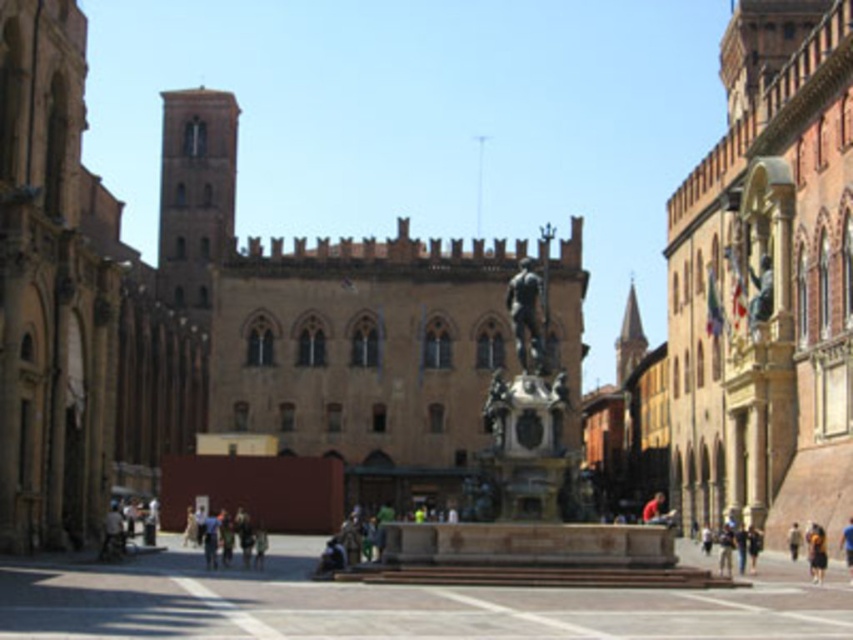
Can you confirm if brown stone bell tower at upper left is positioned above blue fabric person at center?

Yes, brown stone bell tower at upper left is above blue fabric person at center.

Which is behind, point (198, 138) or point (846, 561)?

The point (198, 138) is behind.

Who is more forward, (x=198, y=314) or (x=851, y=556)?

Positioned in front is point (x=851, y=556).

Where is `brown stone bell tower at upper left`? Image resolution: width=853 pixels, height=640 pixels. brown stone bell tower at upper left is located at coordinates (195, 195).

I want to click on polished bronze statue at center, so click(525, 316).

Who is lower down, polished bronze statue at center or blue fabric person at center?

blue fabric person at center is below.

What are the coordinates of `polished bronze statue at center` in the screenshot? It's located at coord(525,316).

Does polished bronze statue at center appear over brown leather jacket at center?

Yes, polished bronze statue at center is above brown leather jacket at center.

Image resolution: width=853 pixels, height=640 pixels. Describe the element at coordinates (525, 316) in the screenshot. I see `polished bronze statue at center` at that location.

This screenshot has width=853, height=640. I want to click on polished bronze statue at center, so click(x=525, y=316).